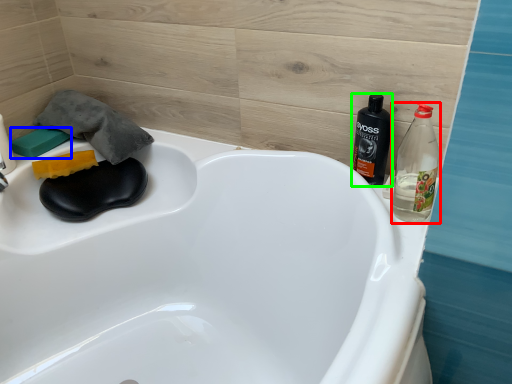
Question: Which object is the farthest from bottle (highlighted by a red box)? Choose among these: soap (highlighted by a blue box) or bottle (highlighted by a green box).

Choices:
 (A) soap
 (B) bottle

Answer: (A)